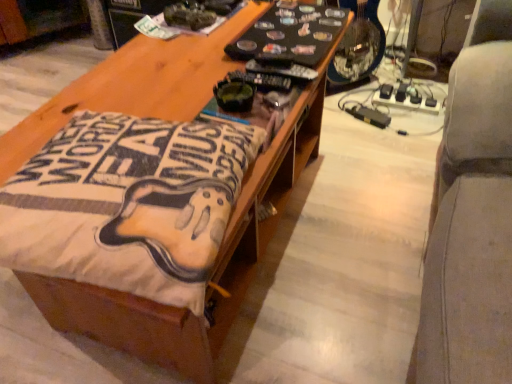
Find the location of a particular element. This screenshot has width=512, height=384. white cotton blanket at lower left is located at coordinates (125, 195).

This screenshot has height=384, width=512. What do you see at coordinates (125, 195) in the screenshot? I see `white cotton blanket at lower left` at bounding box center [125, 195].

What is the approximate width of white cotton blanket at lower left?

white cotton blanket at lower left is 10.94 inches wide.

The height and width of the screenshot is (384, 512). What are the coordinates of `white cotton blanket at lower left` in the screenshot? It's located at (125, 195).